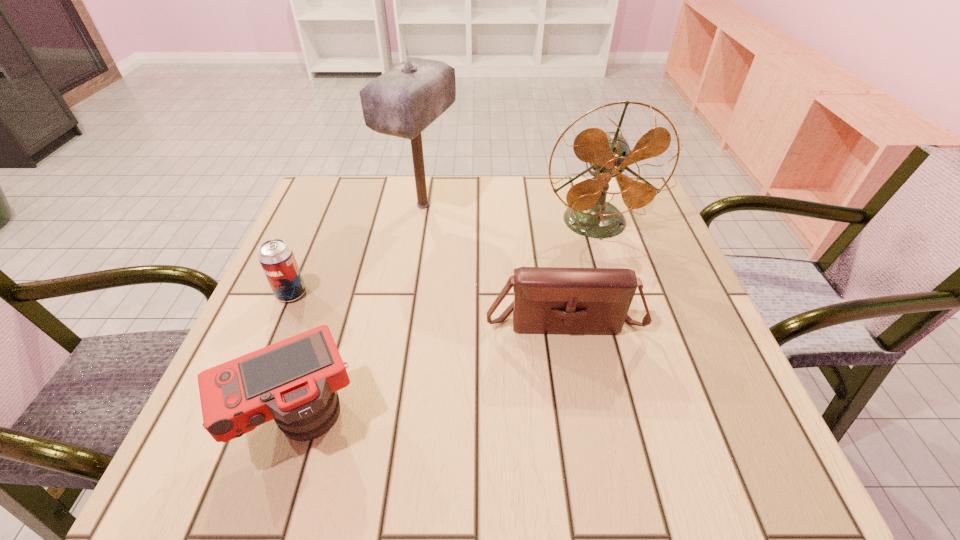
This screenshot has width=960, height=540. What are the coordinates of `mallet at the far edge` in the screenshot? It's located at (402, 102).

Find the location of a particular element. This screenshot has width=960, height=540. fan located at the far edge is located at coordinates (608, 153).

Find the location of a particular element. Image resolution: width=960 pixels, height=540 pixels. object located in the near edge section of the desktop is located at coordinates pos(295,381).

Find the location of a particular element. Image resolution: width=960 pixels, height=540 pixels. camera present at the left edge is located at coordinates (295, 381).

At what (x,y) coordinates should I click in order to perform the action: click on beer can that is at the left edge. Please return your answer as a coordinate pair (x, y). Looking at the image, I should click on (276, 257).

Locate an element on the screen. fan located at the right edge is located at coordinates (608, 153).

The width and height of the screenshot is (960, 540). Identify the location of shoulder bag that is positioned at the right edge. 555,300.

The image size is (960, 540). Identify the location of object that is at the near left corner. (295, 381).

Find the location of a particular element. object that is positioned at the far right corner is located at coordinates (608, 153).

Find the location of a particular element. The image size is (960, 540). vacant space at the far edge is located at coordinates (517, 182).